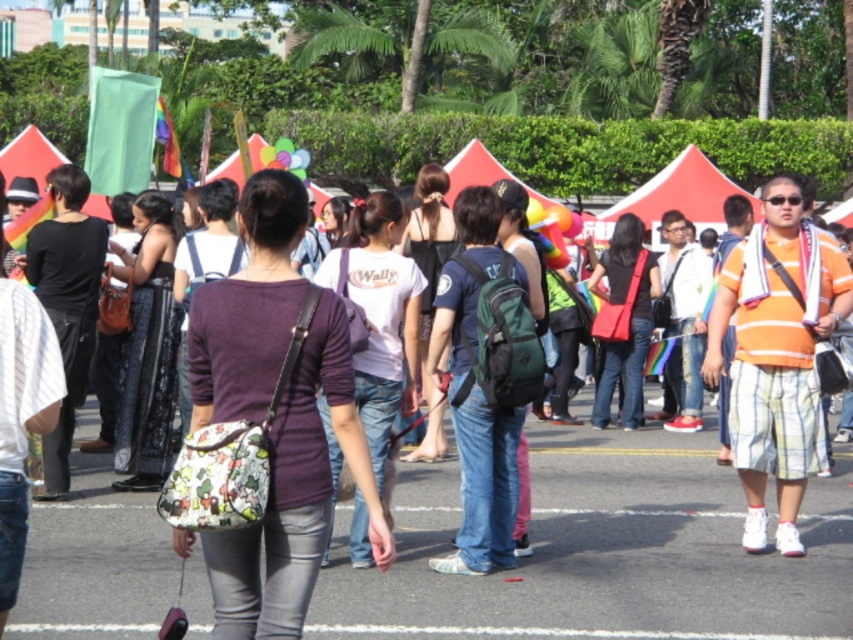
You are a photographer standing at the edge of the crowd. You want to capture both the matte purple shirt at center and the black matte dress at center in the same frame. Given that your camera has a maximum focus range of 20 feet, will you be able to include both subjects in your photo?

The distance between the matte purple shirt at center and the black matte dress at center is 20.79 feet, which exceeds the camera maximum focus range of 20 feet. Therefore, you won not be able to capture both subjects in the same frame.